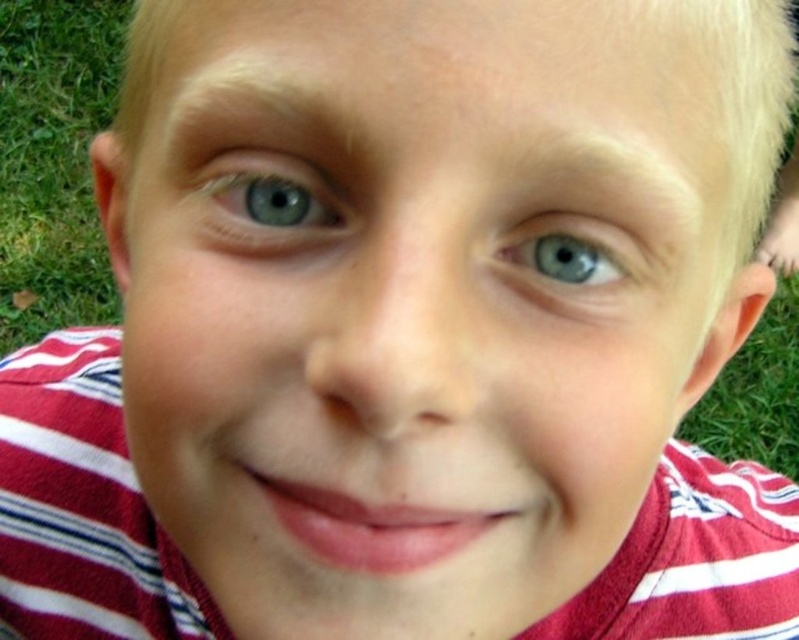
Question: Can you confirm if green grass at lower left is positioned to the left of blue glossy eye at upper center?

Choices:
 (A) no
 (B) yes

Answer: (B)

Question: Can you confirm if blue glossy eye at upper left is smaller than blue glossy eye at upper center?

Choices:
 (A) no
 (B) yes

Answer: (A)

Question: Based on their relative distances, which object is nearer to the blue glossy eye at upper left?

Choices:
 (A) green grass at lower left
 (B) blue glossy eye at upper center

Answer: (B)

Question: Is green grass at lower left positioned at the back of blue glossy eye at upper left?

Choices:
 (A) no
 (B) yes

Answer: (B)

Question: Which object is positioned closest to the blue glossy eye at upper center?

Choices:
 (A) green grass at lower left
 (B) blue glossy eye at upper left

Answer: (B)

Question: Based on their relative distances, which object is nearer to the blue glossy eye at upper center?

Choices:
 (A) blue glossy eye at upper left
 (B) green grass at lower left

Answer: (A)